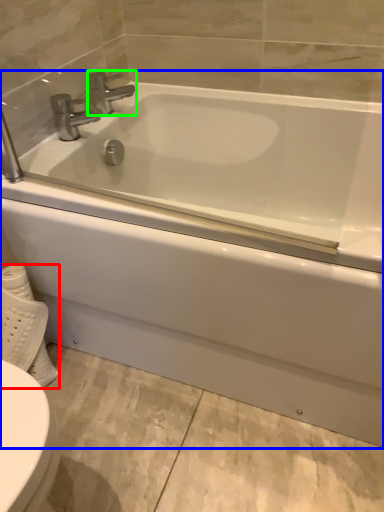
Question: Which object is the farthest from toilet paper (highlighted by a red box)? Choose among these: bathtub (highlighted by a blue box) or tap (highlighted by a green box).

Choices:
 (A) bathtub
 (B) tap

Answer: (B)